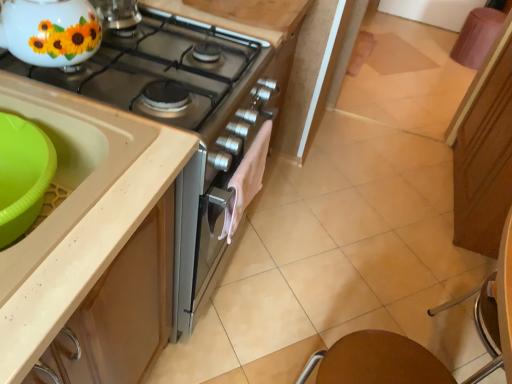
Where is `free space behind brown matte table at lower right`? The height and width of the screenshot is (384, 512). free space behind brown matte table at lower right is located at coordinates (313, 332).